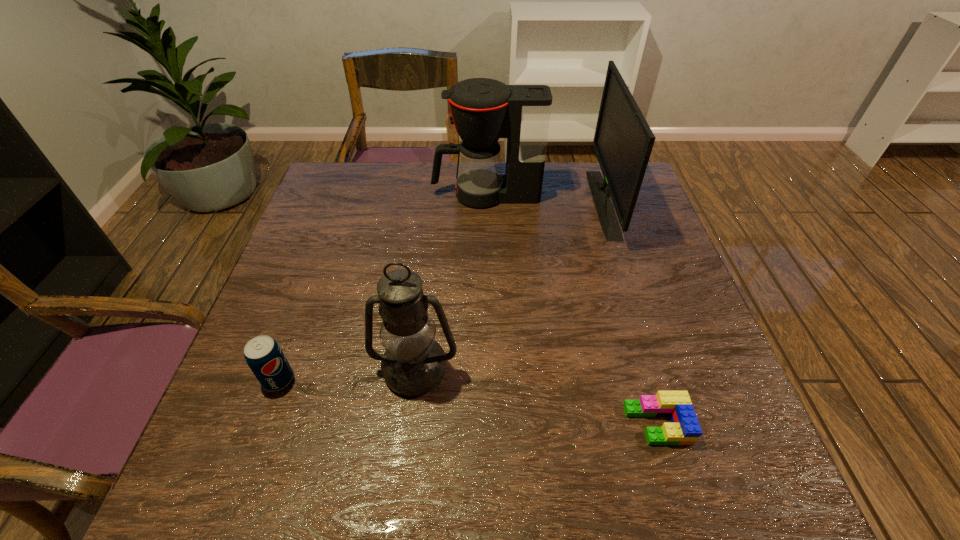
You are a GUI agent. You are given a task and a screenshot of the screen. Output one action in this format:
    pyautogui.click(x=<x>, y=<y>)
    Task: Click on the free space between the monitor and the oil lamp
    This screenshot has width=960, height=540.
    Given the screenshot: What is the action you would take?
    pyautogui.click(x=509, y=286)

Locate an element on the screen. This screenshot has width=960, height=540. unoccupied position between the monitor and the nearest object is located at coordinates (630, 313).

This screenshot has height=540, width=960. In order to click on free spot between the oil lamp and the coffee maker in this screenshot , I will do `click(450, 282)`.

The image size is (960, 540). What are the coordinates of `object that is the second closest one to the shortest object` in the screenshot? It's located at (623, 141).

Locate which object is the third closest to the monitor. Please provide its 2D coordinates. Your answer should be formatted as a tuple, i.e. [(x, y)], where the tuple contains the x and y coordinates of a point satisfying the conditions above.

[(413, 364)]

Find the location of a particular element. The width and height of the screenshot is (960, 540). vacant space that satisfies the following two spatial constraints: 1. on the front-facing side of the monitor; 2. on the front side of the leftmost object is located at coordinates (660, 379).

Where is `free spot that satisfies the following two spatial constraints: 1. on the front side of the leftmost object; 2. on the left side of the Lego`? Image resolution: width=960 pixels, height=540 pixels. free spot that satisfies the following two spatial constraints: 1. on the front side of the leftmost object; 2. on the left side of the Lego is located at coordinates (262, 424).